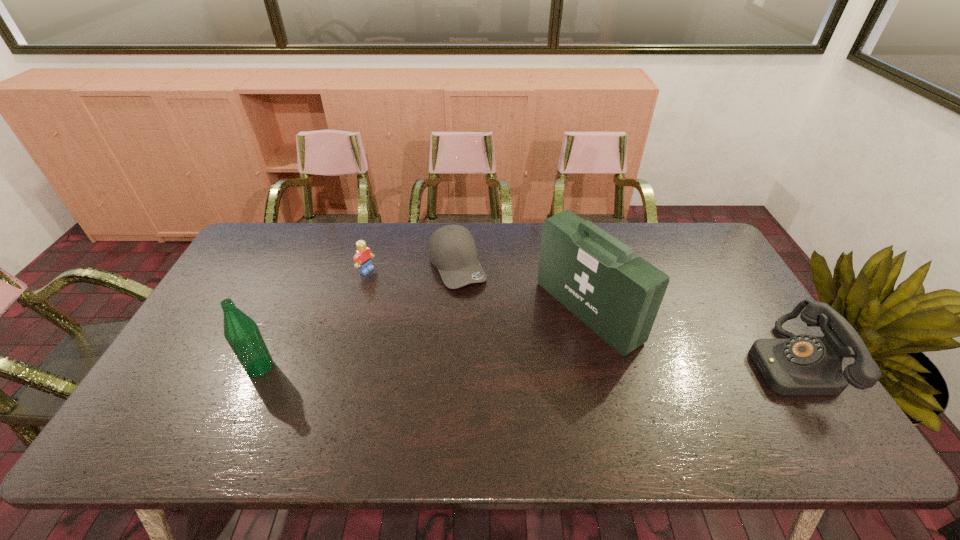
In order to click on baseball cap at the far edge in this screenshot , I will do `click(452, 249)`.

This screenshot has width=960, height=540. Find the location of `Lego positioned at the far edge`. Lego positioned at the far edge is located at coordinates (362, 258).

Where is `object situated at the near edge`? object situated at the near edge is located at coordinates (804, 364).

Image resolution: width=960 pixels, height=540 pixels. I want to click on object at the right edge, so click(x=804, y=364).

This screenshot has width=960, height=540. I want to click on object at the near right corner, so click(x=804, y=364).

Identify the location of free space at the far edge. The width and height of the screenshot is (960, 540). (396, 245).

Find the location of a particular element. The image size is (960, 540). free spot at the near edge of the desktop is located at coordinates (238, 397).

This screenshot has height=540, width=960. In the image, there is a desktop. What are the coordinates of `blank space at the left edge` in the screenshot? It's located at (212, 313).

The width and height of the screenshot is (960, 540). In the image, there is a desktop. What are the coordinates of `vacant space at the right edge` in the screenshot? It's located at (748, 383).

Locate an element on the screen. The height and width of the screenshot is (540, 960). free spot between the baseball cap and the Lego is located at coordinates (412, 268).